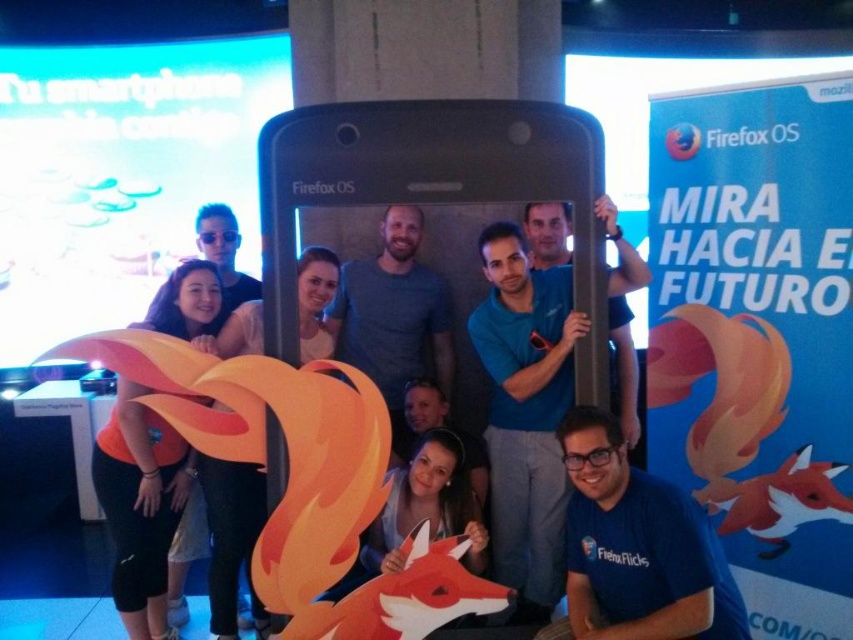
Question: Considering the relative positions of matte black phone at center and matte orange fox at lower left in the image provided, where is matte black phone at center located with respect to matte orange fox at lower left?

Choices:
 (A) below
 (B) above

Answer: (B)

Question: Does matte black phone at center appear on the right side of matte orange fox at lower left?

Choices:
 (A) no
 (B) yes

Answer: (B)

Question: Can you confirm if blue fabric shirt at center is positioned below matte orange fox at lower left?

Choices:
 (A) yes
 (B) no

Answer: (B)

Question: Which object is the closest to the blue fabric shirt at center?

Choices:
 (A) matte orange fox at lower left
 (B) matte black phone at center

Answer: (B)

Question: Which object appears farthest from the camera in this image?

Choices:
 (A) blue fabric shirt at center
 (B) matte orange fox at lower left
 (C) matte black phone at center

Answer: (B)

Question: Estimate the real-world distances between objects in this image. Which object is farther from the matte orange fox at lower left?

Choices:
 (A) blue fabric shirt at center
 (B) matte black phone at center

Answer: (A)